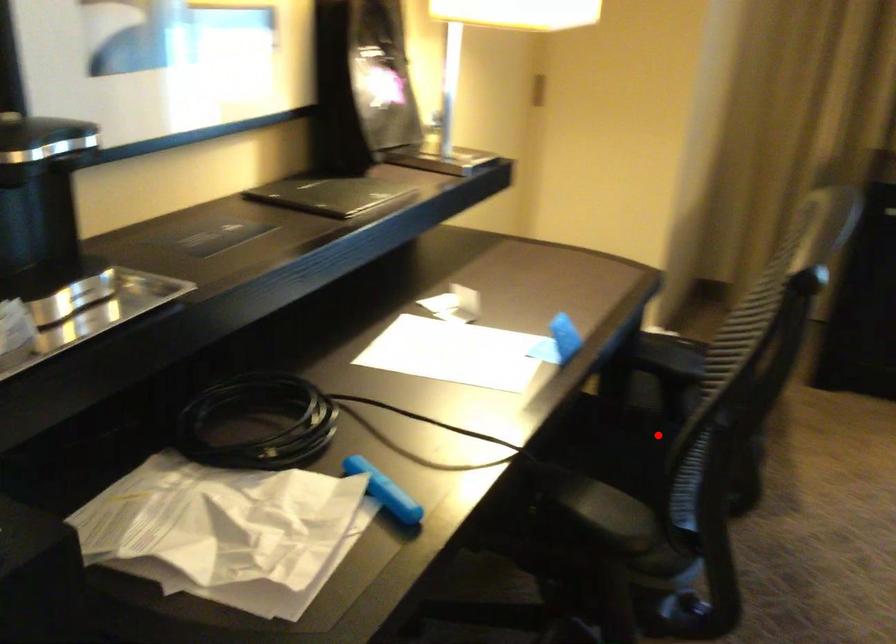
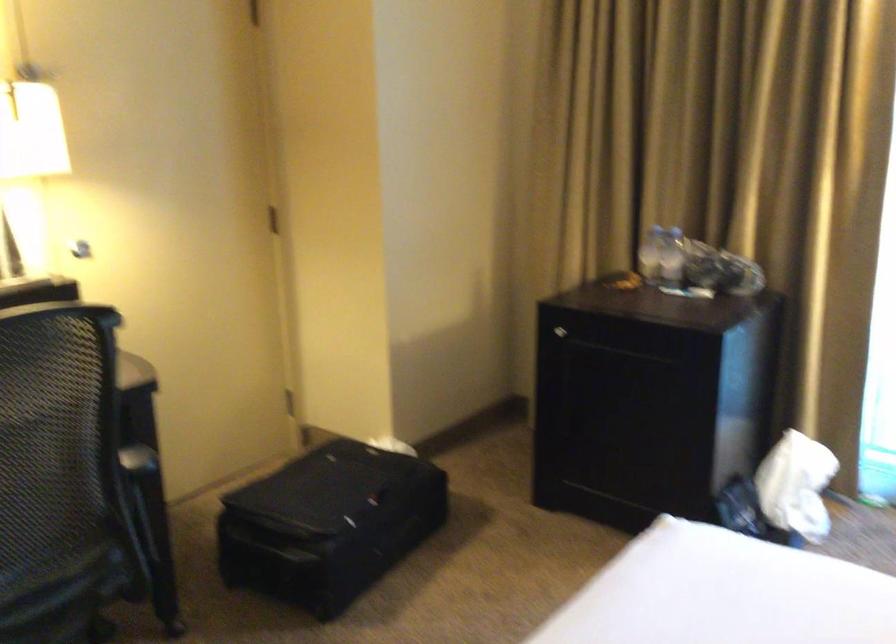
Locate, in the second image, the point that corresponds to the highlighted location in the first image.

(136, 527)